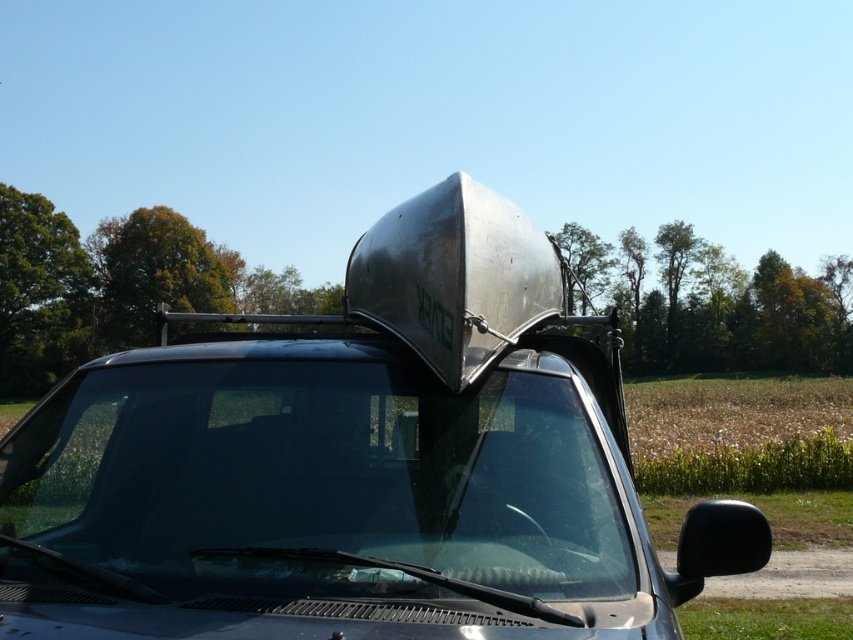
You are standing in front of the vehicle and want to see the road ahead clearly. Which object at point (318, 477) can help you do that?

The transparent glass windshield at center located at point (318, 477) allows clear visibility of the road ahead.

You are standing in front of the vehicle and want to check if the transparent glass windshield at center is directly in front of you. Based on its coordinates, is it positioned in the center of the vehicle?

The transparent glass windshield at center is located at point [318,477], which suggests it is positioned in the center of the vehicle.